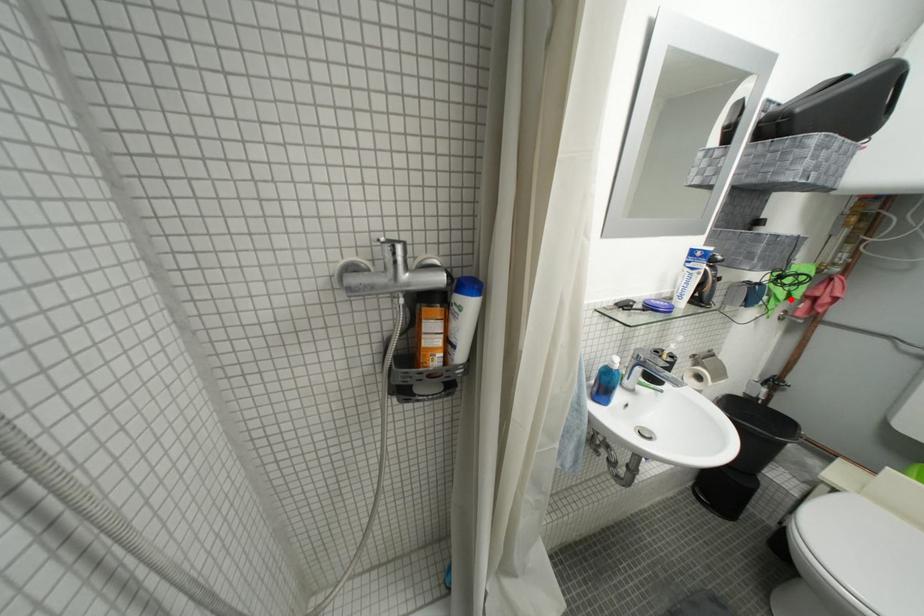
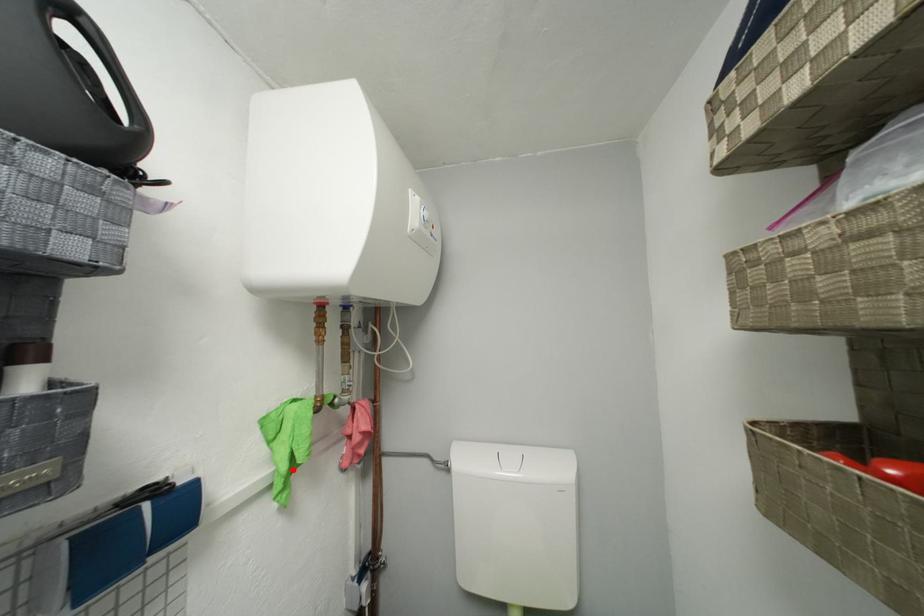
I am providing you with two images of the same scene from different viewpoints. A red point is marked on the first image and another point is marked on the second image. Are the points marked in image1 and image2 representing the same 3D position?

Yes